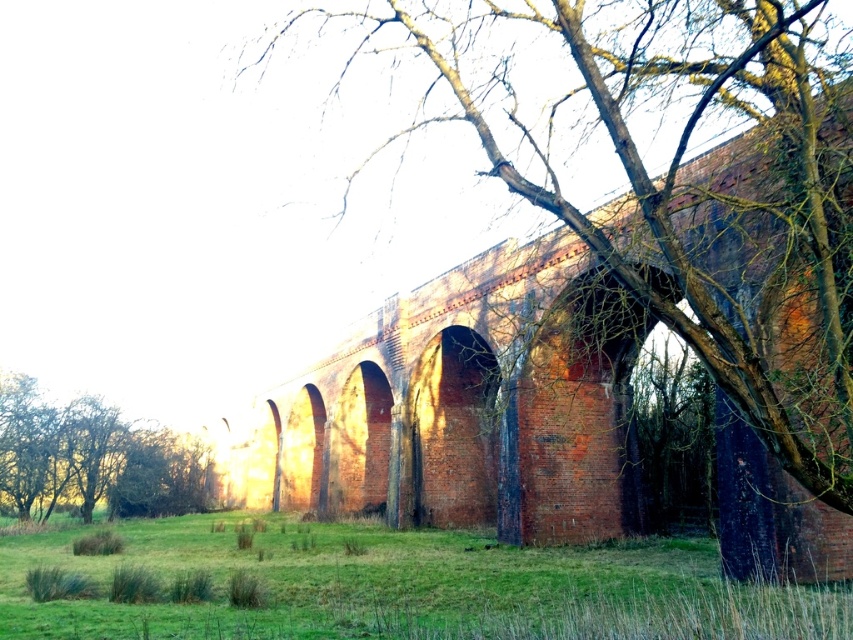
Question: Which object is the closest to the brown textured tree at center?

Choices:
 (A) green leafy tree at lower left
 (B) green grassy at lower center

Answer: (B)

Question: Does brown textured tree at center appear over green leafy tree at lower left?

Choices:
 (A) yes
 (B) no

Answer: (A)

Question: Which is farther from the green leafy tree at lower left?

Choices:
 (A) green grassy at lower center
 (B) brown textured tree at center

Answer: (B)

Question: Which point is closer to the camera taking this photo?

Choices:
 (A) click(160, 509)
 (B) click(775, 112)
 (C) click(834, 636)

Answer: (C)

Question: Is brown textured tree at center above green grassy at lower center?

Choices:
 (A) no
 (B) yes

Answer: (B)

Question: Can you confirm if green grassy at lower center is thinner than green leafy tree at lower left?

Choices:
 (A) yes
 (B) no

Answer: (B)